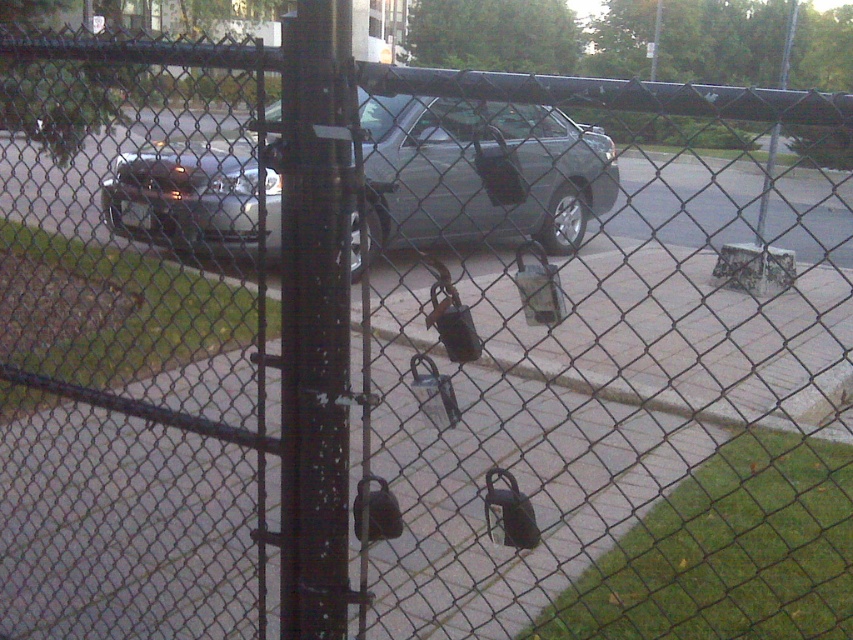
Question: Does metallic gray car at center have a greater width compared to black metal pole at center?

Choices:
 (A) no
 (B) yes

Answer: (B)

Question: Which point is farther from the camera taking this photo?

Choices:
 (A) (x=334, y=317)
 (B) (x=204, y=246)

Answer: (B)

Question: Is metallic gray car at center smaller than black metal pole at center?

Choices:
 (A) no
 (B) yes

Answer: (B)

Question: Which object is closer to the camera taking this photo?

Choices:
 (A) black metal pole at center
 (B) metallic gray car at center

Answer: (A)

Question: Among these objects, which one is farthest from the camera?

Choices:
 (A) black metal pole at center
 (B) metallic gray car at center

Answer: (B)

Question: Is metallic gray car at center bigger than black metal pole at center?

Choices:
 (A) no
 (B) yes

Answer: (A)